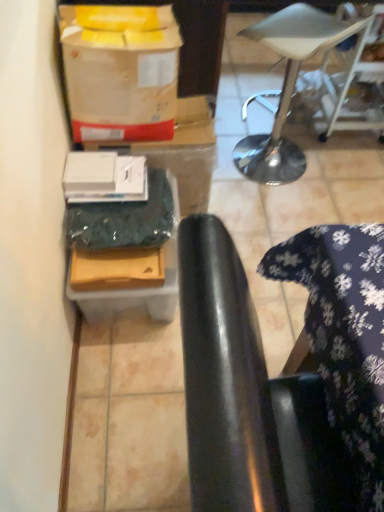
Question: Should I look upward or downward to see matte brown cardboard box at lower left, the 1th cardboard box positioned from the front?

Choices:
 (A) down
 (B) up

Answer: (A)

Question: Is the position of black leather chair at lower right more distant than that of matte brown cardboard box at lower left, the 1th cardboard box positioned from the front?

Choices:
 (A) yes
 (B) no

Answer: (B)

Question: Is black leather chair at lower right touching matte brown cardboard box at lower left, the 1th cardboard box positioned from the front?

Choices:
 (A) no
 (B) yes

Answer: (A)

Question: Does black leather chair at lower right have a smaller size compared to matte brown cardboard box at lower left, positioned as the 2th cardboard box in back-to-front order?

Choices:
 (A) yes
 (B) no

Answer: (B)

Question: From a real-world perspective, is black leather chair at lower right under matte brown cardboard box at lower left, positioned as the 2th cardboard box in back-to-front order?

Choices:
 (A) no
 (B) yes

Answer: (A)

Question: Is black leather chair at lower right not near matte brown cardboard box at lower left, the 1th cardboard box positioned from the front?

Choices:
 (A) yes
 (B) no

Answer: (B)

Question: Is black leather chair at lower right located outside matte brown cardboard box at lower left, the 1th cardboard box positioned from the front?

Choices:
 (A) yes
 (B) no

Answer: (A)

Question: Could you tell me if matte brown cardboard box at lower left, the 1th cardboard box positioned from the front, is facing black leather chair at lower right?

Choices:
 (A) yes
 (B) no

Answer: (B)

Question: Is matte brown cardboard box at lower left, the 1th cardboard box positioned from the front, not within black leather chair at lower right?

Choices:
 (A) yes
 (B) no

Answer: (A)

Question: Considering the relative positions of matte brown cardboard box at lower left, positioned as the 2th cardboard box in back-to-front order, and black leather chair at lower right in the image provided, is matte brown cardboard box at lower left, positioned as the 2th cardboard box in back-to-front order, to the right of black leather chair at lower right from the viewer's perspective?

Choices:
 (A) no
 (B) yes

Answer: (A)

Question: Does matte brown cardboard box at lower left, positioned as the 2th cardboard box in back-to-front order, come behind black leather chair at lower right?

Choices:
 (A) no
 (B) yes

Answer: (B)

Question: Considering the relative sizes of matte brown cardboard box at lower left, positioned as the 2th cardboard box in back-to-front order, and black leather chair at lower right in the image provided, is matte brown cardboard box at lower left, positioned as the 2th cardboard box in back-to-front order, thinner than black leather chair at lower right?

Choices:
 (A) no
 (B) yes

Answer: (B)

Question: From the image's perspective, does matte brown cardboard box at lower left, positioned as the 2th cardboard box in back-to-front order, appear higher than black leather chair at lower right?

Choices:
 (A) no
 (B) yes

Answer: (B)

Question: Considering the relative sizes of matte cardboard wrapping paper at upper left and white leather stool at upper right in the image provided, is matte cardboard wrapping paper at upper left taller than white leather stool at upper right?

Choices:
 (A) yes
 (B) no

Answer: (B)